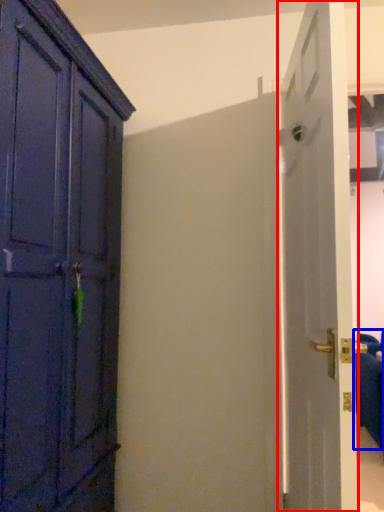
Question: Among these objects, which one is farthest to the camera, door (highlighted by a red box) or furniture (highlighted by a blue box)?

Choices:
 (A) door
 (B) furniture

Answer: (B)